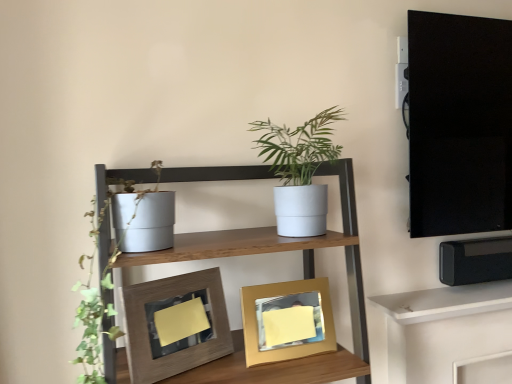
Question: From a real-world perspective, is white matte shelf at upper right, which ranks as the 2th shelf in left-to-right order, beneath wooden textured frame at center, which appears as the 2th picture frame when viewed from the right?

Choices:
 (A) yes
 (B) no

Answer: (A)

Question: Is white matte shelf at upper right, marked as the 2th shelf in a front-to-back arrangement, positioned in front of wooden textured frame at center, the first picture frame in the left-to-right sequence?

Choices:
 (A) no
 (B) yes

Answer: (A)

Question: Is wooden textured frame at center, which appears as the 2th picture frame when viewed from the right, at the back of white matte shelf at upper right, marked as the 2th shelf in a front-to-back arrangement?

Choices:
 (A) no
 (B) yes

Answer: (A)

Question: Is white matte shelf at upper right, which is the first shelf from bottom to top, at the right side of wooden textured frame at center, which appears as the 2th picture frame when viewed from the right?

Choices:
 (A) no
 (B) yes

Answer: (B)

Question: From the image's perspective, is white matte shelf at upper right, the first shelf in the back-to-front sequence, beneath wooden textured frame at center, which appears as the 2th picture frame when viewed from the right?

Choices:
 (A) no
 (B) yes

Answer: (B)

Question: Is gold metallic picture frame at center, acting as the second picture frame starting from the left, in front of or behind matte white pot at left in the image?

Choices:
 (A) behind
 (B) front

Answer: (A)

Question: Based on their sizes in the image, would you say gold metallic picture frame at center, the first picture frame in the right-to-left sequence, is bigger or smaller than matte white pot at left?

Choices:
 (A) small
 (B) big

Answer: (A)

Question: Is gold metallic picture frame at center, the first picture frame in the right-to-left sequence, inside or outside of matte white pot at left?

Choices:
 (A) inside
 (B) outside

Answer: (B)

Question: Looking at their shapes, would you say gold metallic picture frame at center, the first picture frame in the right-to-left sequence, is wider or thinner than matte white pot at left?

Choices:
 (A) wide
 (B) thin

Answer: (B)

Question: Would you say wooden textured frame at center, the first picture frame in the left-to-right sequence, is to the left or to the right of matte white pot at left in the picture?

Choices:
 (A) left
 (B) right

Answer: (B)

Question: From their relative heights in the image, would you say wooden textured frame at center, the first picture frame in the left-to-right sequence, is taller or shorter than matte white pot at left?

Choices:
 (A) tall
 (B) short

Answer: (B)

Question: Is wooden textured frame at center, which appears as the 2th picture frame when viewed from the right, bigger or smaller than matte white pot at left?

Choices:
 (A) small
 (B) big

Answer: (A)

Question: From a real-world perspective, is wooden textured frame at center, the first picture frame in the left-to-right sequence, physically located above or below matte white pot at left?

Choices:
 (A) above
 (B) below

Answer: (B)

Question: From the image's perspective, is white matte shelf at upper right, marked as the 2th shelf in a front-to-back arrangement, positioned above or below matte white pot at left?

Choices:
 (A) below
 (B) above

Answer: (A)

Question: Considering the positions of point (414, 317) and point (135, 216), is point (414, 317) closer or farther from the camera than point (135, 216)?

Choices:
 (A) farther
 (B) closer

Answer: (A)